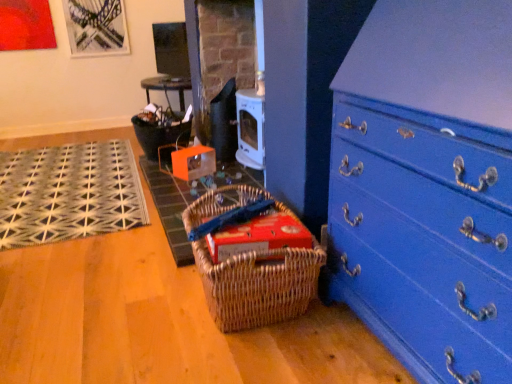
Find the location of a particular element. vacant space in front of woven brown picnic basket at lower center is located at coordinates (255, 354).